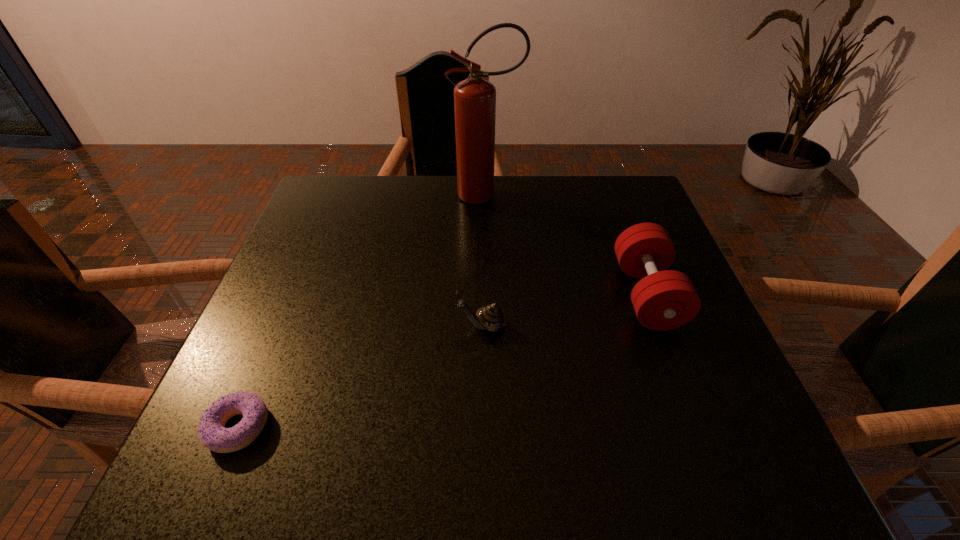
Locate an element on the screen. This screenshot has height=540, width=960. empty location between the dumbbell and the nearest object is located at coordinates (443, 361).

This screenshot has width=960, height=540. Identify the location of free space between the dumbbell and the farthest object. (566, 245).

Where is `free space that is in between the rightmost object and the tallest object`? free space that is in between the rightmost object and the tallest object is located at coordinates (566, 245).

At what (x,y) coordinates should I click in order to perform the action: click on blank region between the shortest object and the farthest object. Please return your answer as a coordinate pair (x, y). This screenshot has width=960, height=540. Looking at the image, I should click on (362, 311).

The image size is (960, 540). In order to click on vacant point located between the snail and the dumbbell in this screenshot , I will do `click(564, 310)`.

Locate an element on the screen. Image resolution: width=960 pixels, height=540 pixels. unoccupied area between the rightmost object and the snail is located at coordinates [x=564, y=310].

This screenshot has height=540, width=960. I want to click on empty space between the tallest object and the rightmost object, so click(566, 245).

Identify which object is the second closest to the snail. Please provide its 2D coordinates. Your answer should be formatted as a tuple, i.e. [(x, y)], where the tuple contains the x and y coordinates of a point satisfying the conditions above.

[(212, 432)]

Point out which object is positioned as the third nearest to the tallest object. Please provide its 2D coordinates. Your answer should be formatted as a tuple, i.e. [(x, y)], where the tuple contains the x and y coordinates of a point satisfying the conditions above.

[(212, 432)]

This screenshot has height=540, width=960. In order to click on vacant space that satisfies the following two spatial constraints: 1. on the back side of the dumbbell; 2. from the nozzle of the tallest object in this screenshot , I will do `click(610, 195)`.